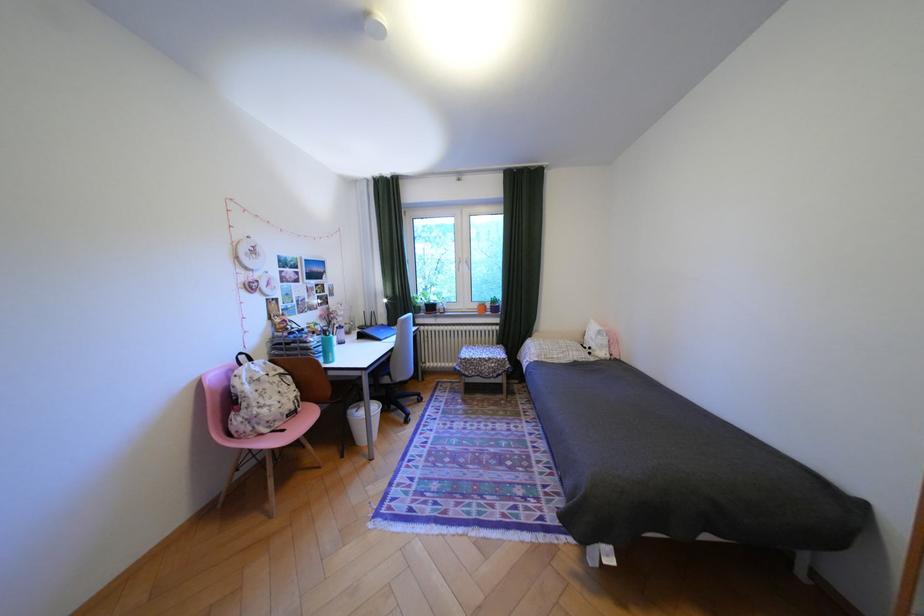
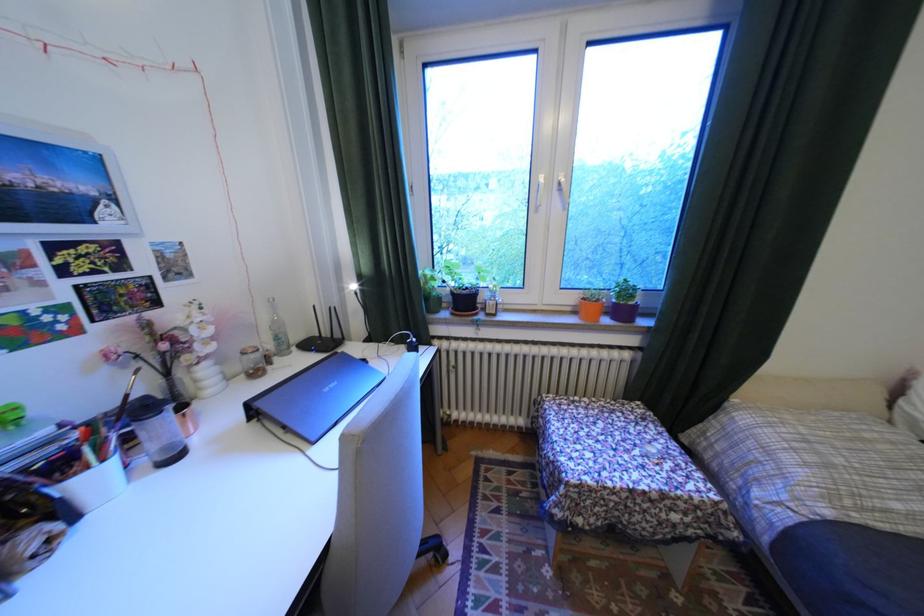
Locate, in the second image, the point that corresponds to point (477, 265) in the first image.

(566, 195)